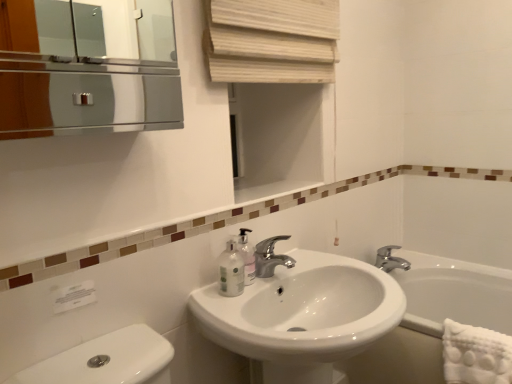
Question: Is translucent plastic soap dispenser at sink closer to the viewer compared to polished chrome faucet at center, the second tap positioned from the right?

Choices:
 (A) yes
 (B) no

Answer: (B)

Question: Is translucent plastic soap dispenser at sink located outside polished chrome faucet at center, which is the second tap from back to front?

Choices:
 (A) yes
 (B) no

Answer: (A)

Question: Can you confirm if translucent plastic soap dispenser at sink is thinner than polished chrome faucet at center, the 1th tap from the front?

Choices:
 (A) no
 (B) yes

Answer: (B)

Question: From a real-world perspective, does translucent plastic soap dispenser at sink sit lower than polished chrome faucet at center, the first tap positioned from the left?

Choices:
 (A) yes
 (B) no

Answer: (B)

Question: From a real-world perspective, is translucent plastic soap dispenser at sink physically above polished chrome faucet at center, the first tap positioned from the left?

Choices:
 (A) no
 (B) yes

Answer: (B)

Question: Looking at their shapes, would you say silver metallic faucet at center, the 2th tap when ordered from front to back, is wider or thinner than translucent plastic soap dispenser at sink?

Choices:
 (A) wide
 (B) thin

Answer: (A)

Question: Does point click(x=379, y=248) appear closer or farther from the camera than point click(x=245, y=238)?

Choices:
 (A) closer
 (B) farther

Answer: (B)

Question: In terms of height, does silver metallic faucet at center, the 2th tap viewed from the left, look taller or shorter compared to translucent plastic soap dispenser at sink?

Choices:
 (A) short
 (B) tall

Answer: (A)

Question: From a real-world perspective, relative to translucent plastic soap dispenser at sink, is silver metallic faucet at center, the 2th tap viewed from the left, vertically above or below?

Choices:
 (A) below
 (B) above

Answer: (A)

Question: In terms of height, does white glossy sink at center look taller or shorter compared to white textured towel at lower right?

Choices:
 (A) short
 (B) tall

Answer: (B)

Question: Is white glossy sink at center inside or outside of white textured towel at lower right?

Choices:
 (A) outside
 (B) inside

Answer: (A)

Question: From a real-world perspective, is white glossy sink at center positioned above or below white textured towel at lower right?

Choices:
 (A) below
 (B) above

Answer: (A)

Question: From the image's perspective, is white glossy sink at center located above or below white textured towel at lower right?

Choices:
 (A) above
 (B) below

Answer: (B)

Question: Considering the positions of white textured towel at lower right and translucent plastic soap dispenser at sink in the image, is white textured towel at lower right taller or shorter than translucent plastic soap dispenser at sink?

Choices:
 (A) tall
 (B) short

Answer: (A)

Question: From a real-world perspective, is white textured towel at lower right positioned above or below translucent plastic soap dispenser at sink?

Choices:
 (A) above
 (B) below

Answer: (B)